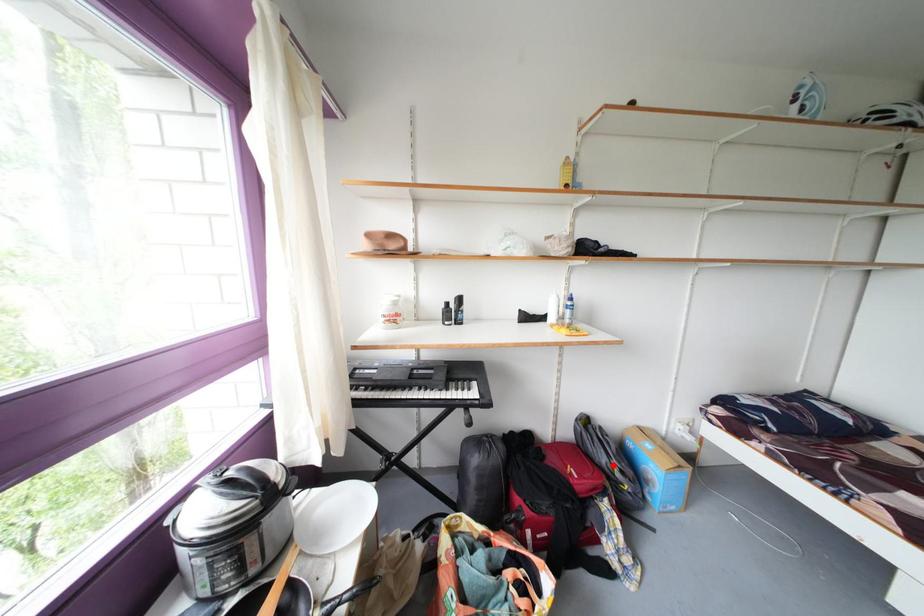
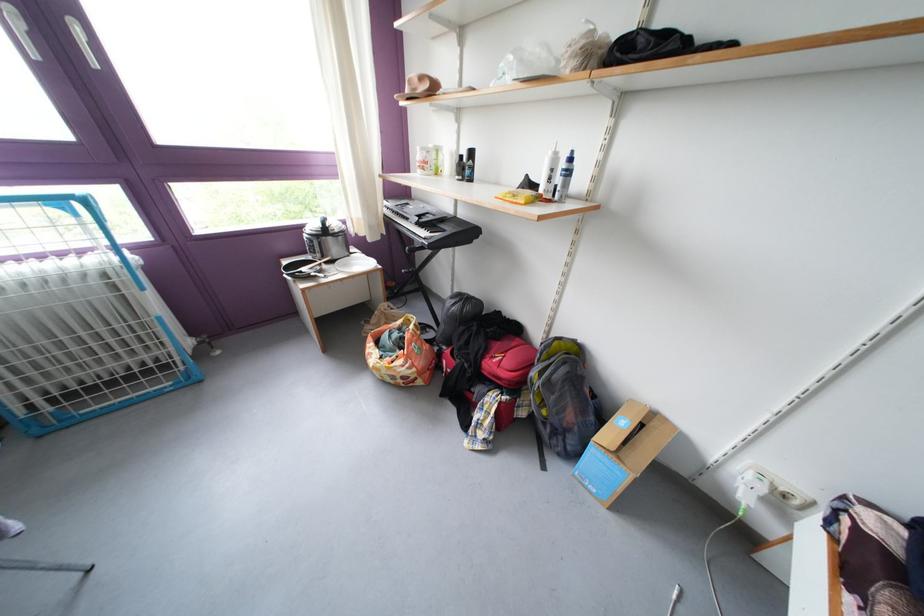
Question: I am providing you with two images of the same scene from different viewpoints. A red point is shown in image1. For the corresponding object point in image2, is it positioned nearer or farther from the camera?

Choices:
 (A) Nearer
 (B) Farther

Answer: (A)